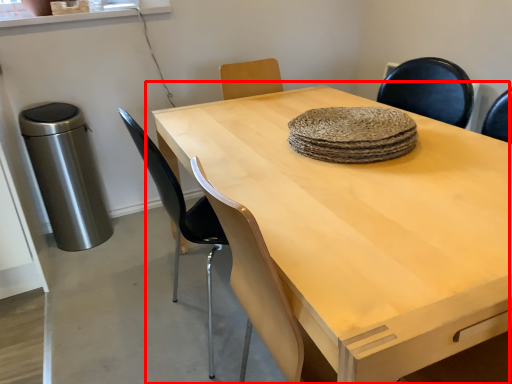
Question: From the image's perspective, where is table (annotated by the red box) located relative to chair?

Choices:
 (A) below
 (B) above

Answer: (A)